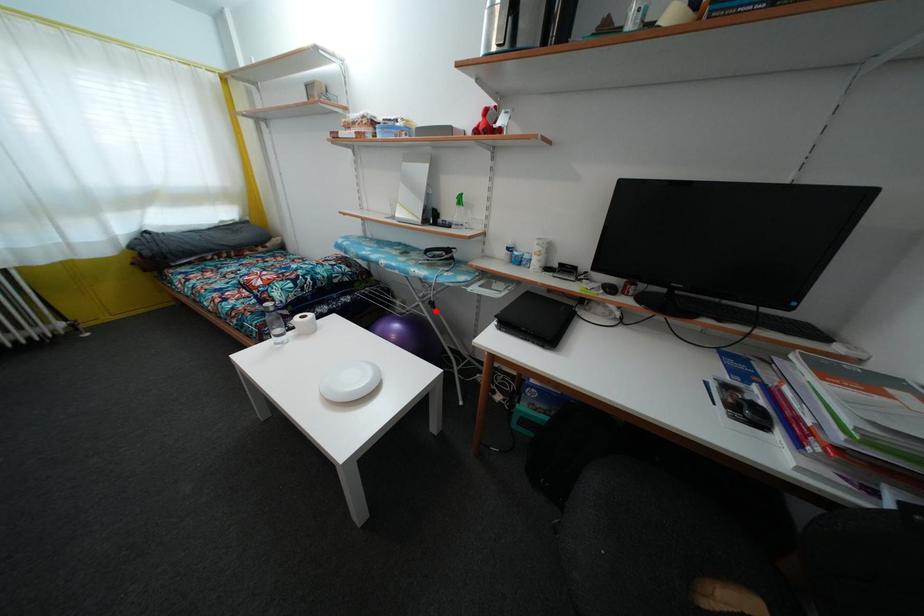
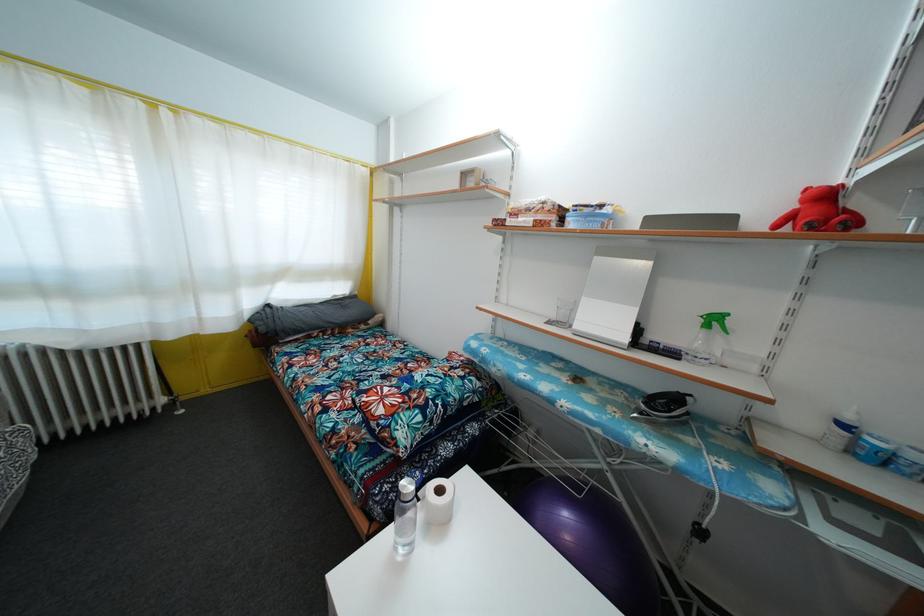
Question: I am providing you with two images of the same scene from different viewpoints. A red point is marked on the first image. At the location where the point appears in image 1, is it still visible in image 2?

Choices:
 (A) Yes
 (B) No

Answer: (A)